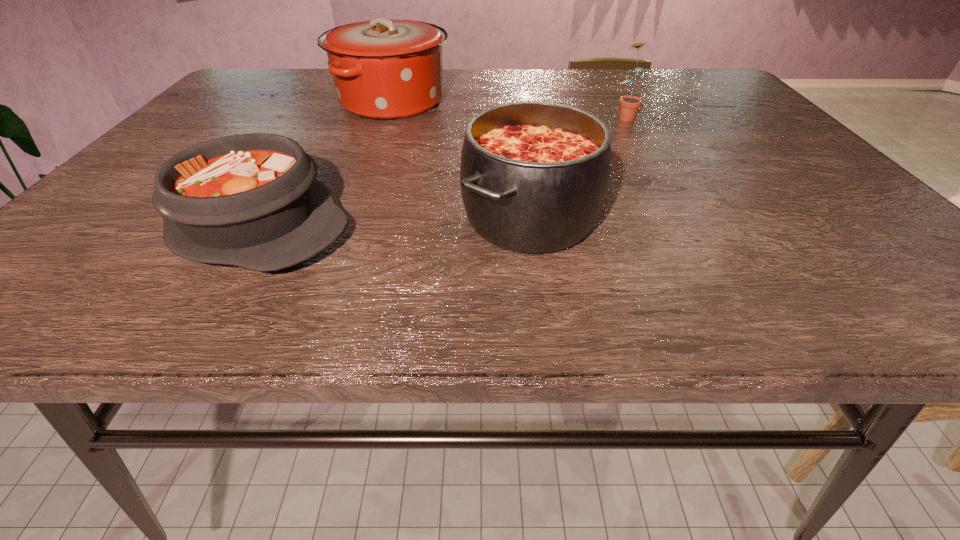
Where is `object located in the near edge section of the desktop`? object located in the near edge section of the desktop is located at coordinates (251, 200).

You are a GUI agent. You are given a task and a screenshot of the screen. Output one action in this format:
    pyautogui.click(x=<x>, y=<y>)
    Task: Click on the object present at the left edge
    Image resolution: width=960 pixels, height=540 pixels.
    Given the screenshot: What is the action you would take?
    pyautogui.click(x=251, y=200)

At what (x,y) coordinates should I click in order to perform the action: click on object situated at the near left corner. Please return your answer as a coordinate pair (x, y). Image resolution: width=960 pixels, height=540 pixels. Looking at the image, I should click on (251, 200).

In the image, there is a desktop. What are the coordinates of `free space at the far edge` in the screenshot? It's located at (468, 75).

This screenshot has width=960, height=540. What are the coordinates of `vacant space at the left edge of the desktop` in the screenshot? It's located at (215, 120).

The image size is (960, 540). I want to click on vacant space at the right edge of the desktop, so tap(725, 141).

Identify the location of vacant area that lies between the rightmost casserole and the shortest object. The image size is (960, 540). (394, 221).

This screenshot has width=960, height=540. In order to click on empty location between the tallest casserole and the shortest casserole in this screenshot , I will do `click(324, 163)`.

Locate an element on the screen. free spot between the third object from left to right and the shortest object is located at coordinates (394, 221).

This screenshot has width=960, height=540. I want to click on free spot between the rightmost casserole and the tallest casserole, so click(461, 159).